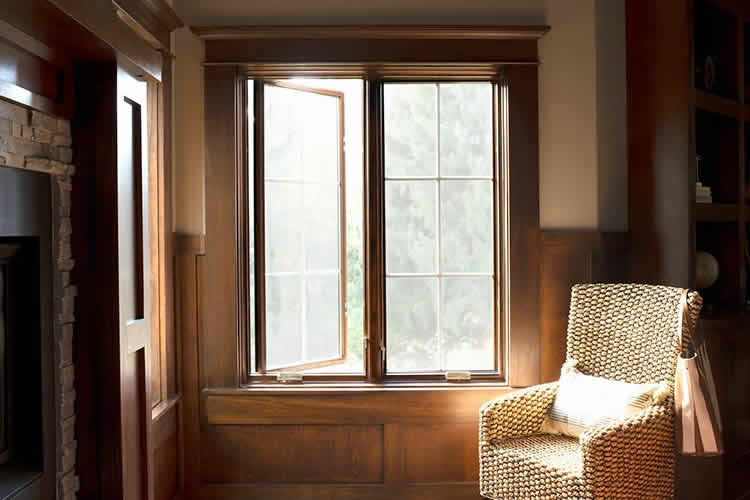
I want to click on chair, so click(518, 420).